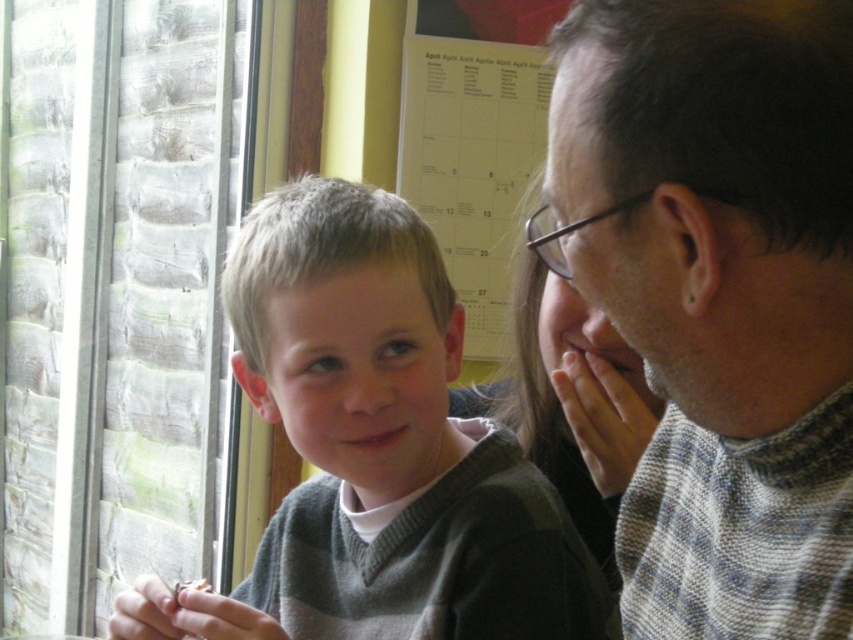
Image resolution: width=853 pixels, height=640 pixels. I want to click on gray knitted sweater at right, so click(718, 296).

The height and width of the screenshot is (640, 853). In order to click on gray knitted sweater at right in this screenshot , I will do `click(718, 296)`.

Looking at this image, does gray knitted sweater at right appear on the left side of gray sweater at left?

In fact, gray knitted sweater at right is to the right of gray sweater at left.

At what (x,y) coordinates should I click in order to perform the action: click on gray knitted sweater at right. Please return your answer as a coordinate pair (x, y). Looking at the image, I should click on (718, 296).

Locate an element on the screen. Image resolution: width=853 pixels, height=640 pixels. gray knitted sweater at right is located at coordinates (718, 296).

Which of these two, gray sweater at left or white paper calendar at upper center, stands shorter?

Standing shorter between the two is gray sweater at left.

Which is more to the left, gray sweater at left or white paper calendar at upper center?

From the viewer's perspective, gray sweater at left appears more on the left side.

The width and height of the screenshot is (853, 640). What are the coordinates of `gray sweater at left` in the screenshot? It's located at (375, 451).

Where is `gray sweater at left`? The width and height of the screenshot is (853, 640). gray sweater at left is located at coordinates (375, 451).